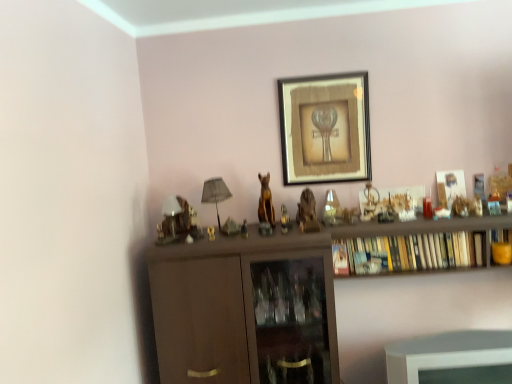
Question: In terms of height, does metallic gold statue at center, which is counted as the 2th toy, starting from the right, look taller or shorter compared to matte black lampshade at center?

Choices:
 (A) short
 (B) tall

Answer: (A)

Question: From a real-world perspective, is metallic gold statue at center, placed as the third toy when sorted from left to right, above or below matte black lampshade at center?

Choices:
 (A) above
 (B) below

Answer: (B)

Question: Which object is the farthest from the gold metallic statue at center, the first animal in the left-to-right sequence?

Choices:
 (A) wooden bookshelf at center
 (B) metallic gold figurine at left, the fourth toy positioned from the right
 (C) matte brown statue at center, arranged as the second toy when viewed from the left
 (D) wooden framed artwork at center
 (E) wooden statue at center, which is the second animal in left-to-right order

Answer: (A)

Question: Which of these objects is positioned closest to the matte brown statue at center, arranged as the third toy when viewed from the right?

Choices:
 (A) translucent glass vase at center, the first toy when ordered from right to left
 (B) metallic gold figurine at left, the fourth toy positioned from the right
 (C) gold metallic statue at center, which ranks as the second animal in right-to-left order
 (D) wooden bookshelf at center
 (E) metallic gold statue at center, placed as the third toy when sorted from left to right

Answer: (C)